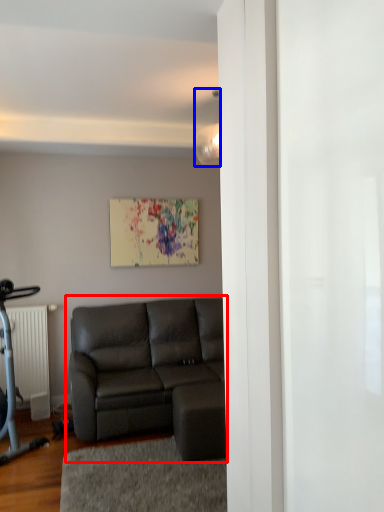
Question: Which of the following is the closest to the observer, studio couch (highlighted by a red box) or light fixture (highlighted by a blue box)?

Choices:
 (A) studio couch
 (B) light fixture

Answer: (A)